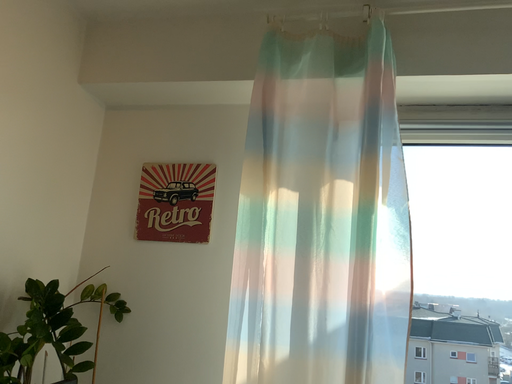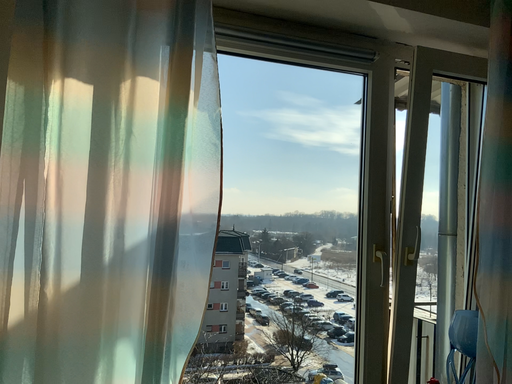
Question: How did the camera likely rotate when shooting the video?

Choices:
 (A) rotated right
 (B) rotated left

Answer: (A)